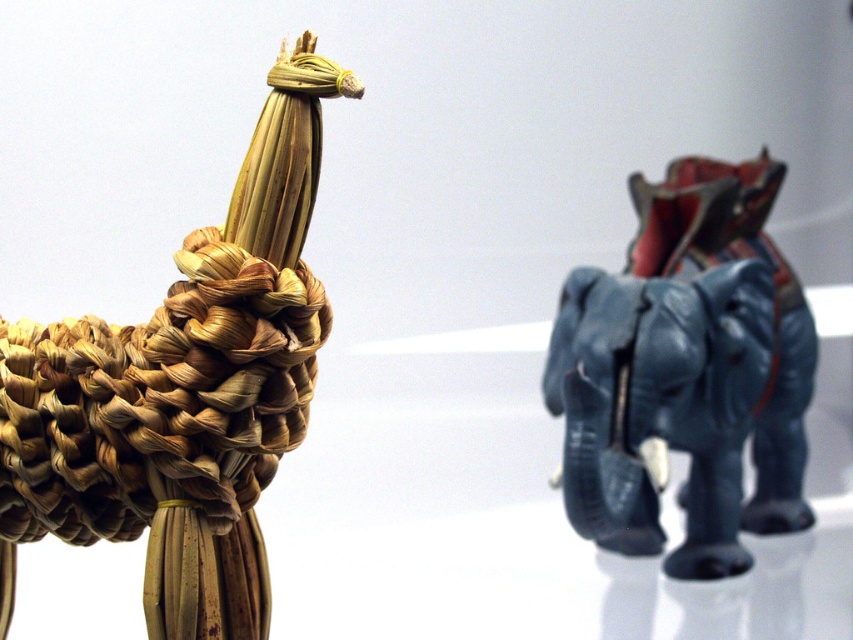
You are an art curator arranging a display. You need to place a new sculpture exactly halfway between the two objects in the image. The new sculpture must be placed along the line connecting the two objects. Given that the braided straw elephant at center is at point coordinates of 0.611, 0.216, can you determine the coordinates where the new sculpture should be placed?

The new sculpture should be placed at the midpoint between the two objects. Since the braided straw elephant at center is at point coordinates of (183,390), and the other object is the handcrafted woven giraffe on the left side, the midpoint would be halfway between their coordinates. However, the exact coordinates of the giraffe are not provided in the Objects Description. Without the giraffe coordinates, the exact midpoint cannot be calculated.